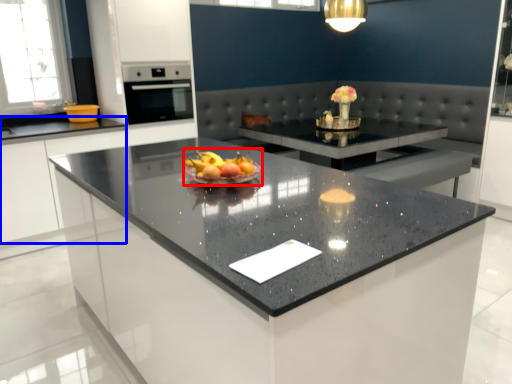
Question: Among these objects, which one is farthest to the camera, fruit dish (highlighted by a red box) or cabinetry (highlighted by a blue box)?

Choices:
 (A) fruit dish
 (B) cabinetry

Answer: (B)